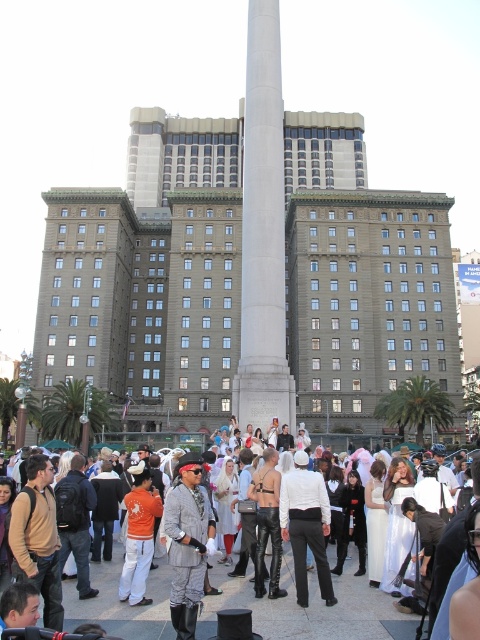
Question: Which point appears closest to the camera in this image?

Choices:
 (A) (300, 461)
 (B) (193, 634)

Answer: (B)

Question: Which object appears farthest from the camera in this image?

Choices:
 (A) gray stone building at center
 (B) silver metallic armor at center

Answer: (A)

Question: Does gray stone building at center have a lesser width compared to silver metallic armor at center?

Choices:
 (A) yes
 (B) no

Answer: (B)

Question: Can you confirm if white marble column at center is positioned to the right of white matte pants at center?

Choices:
 (A) no
 (B) yes

Answer: (A)

Question: Can you confirm if white marble column at center is positioned below silver metallic armor at center?

Choices:
 (A) no
 (B) yes

Answer: (A)

Question: Which of these objects is positioned farthest from the white matte pants at center?

Choices:
 (A) gray fabric jacket at center
 (B) gray stone building at center
 (C) orange cotton shirt at center

Answer: (B)